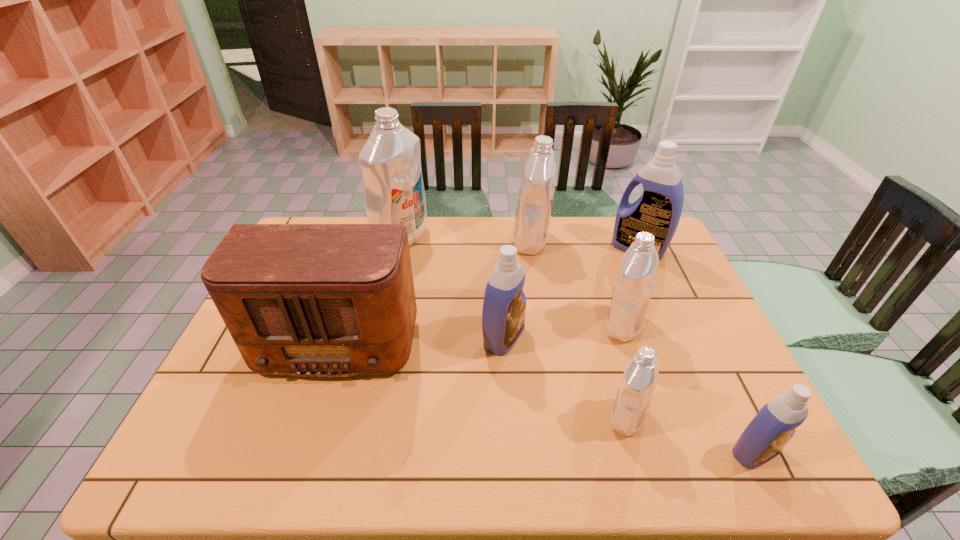
Identify the location of object located in the near right corner section of the desktop. The height and width of the screenshot is (540, 960). (763, 439).

This screenshot has height=540, width=960. In order to click on vacant space at the far edge of the desktop in this screenshot , I will do `click(561, 249)`.

I want to click on free space at the near edge of the desktop, so click(657, 458).

Where is `blank area at the right edge`? blank area at the right edge is located at coordinates coord(698,301).

Locate an element on the screen. vacant space that's between the farthest blue detergent and the nearest blue detergent is located at coordinates (697, 350).

Locate an element on the screen. The width and height of the screenshot is (960, 540). free space between the smallest blue detergent and the biggest blue detergent is located at coordinates (697, 350).

The height and width of the screenshot is (540, 960). I want to click on free space between the leftmost detergent and the nearest blue detergent, so click(x=578, y=345).

Locate an element on the screen. The width and height of the screenshot is (960, 540). free spot between the smallest white detergent and the third white detergent from right to left is located at coordinates (579, 329).

This screenshot has height=540, width=960. Identify the location of vacant region between the nearest white detergent and the second biggest white detergent. (579, 329).

The height and width of the screenshot is (540, 960). In order to click on free space between the smallest blue detergent and the smallest white detergent in this screenshot , I will do `click(691, 435)`.